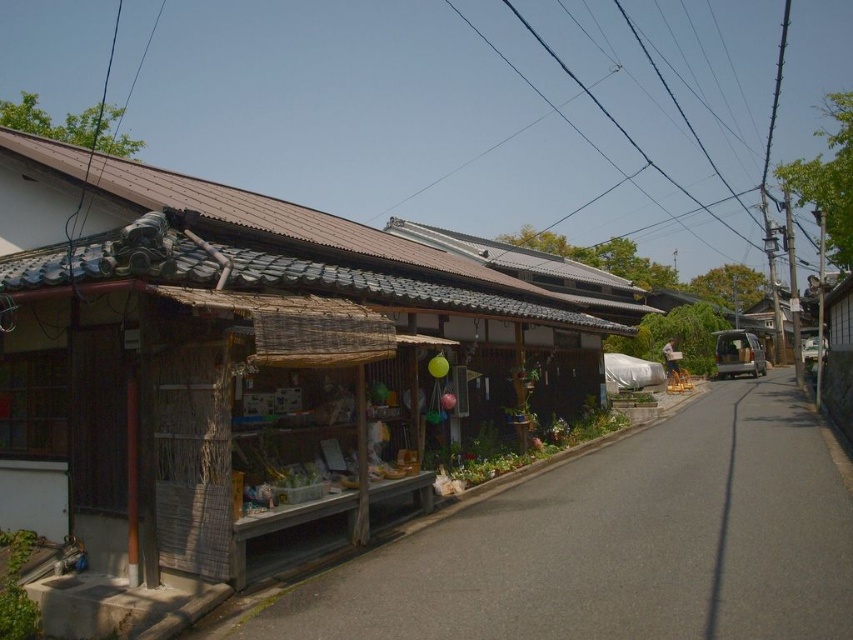
Who is more forward, (625, 580) or (737, 198)?

Point (625, 580) is more forward.

Can you confirm if wooden stall at lower left is positioned to the left of black wire at upper center?

Indeed, wooden stall at lower left is positioned on the left side of black wire at upper center.

Who is more forward, (x=717, y=502) or (x=689, y=196)?

Point (x=717, y=502) is more forward.

Where is `wooden stall at lower left`? This screenshot has width=853, height=640. wooden stall at lower left is located at coordinates click(x=618, y=545).

The image size is (853, 640). I want to click on wooden hut at center, so click(x=244, y=360).

Can you confirm if wooden hut at center is thinner than black wire at upper center?

Indeed, wooden hut at center has a lesser width compared to black wire at upper center.

Is point (343, 428) farther from viewer compared to point (503, 0)?

That is False.

You are a GUI agent. You are given a task and a screenshot of the screen. Output one action in this format:
    pyautogui.click(x=<x>, y=<y>)
    Task: Click on the wooden hut at center
    
    Given the screenshot: What is the action you would take?
    pyautogui.click(x=244, y=360)

Is point (20, 474) closer to viewer compared to point (415, 538)?

That is True.

Does wooden hut at center appear under wooden stall at lower left?

Incorrect, wooden hut at center is not positioned below wooden stall at lower left.

Who is more forward, (78, 451) or (776, 429)?

Point (78, 451) is in front.

This screenshot has width=853, height=640. What are the coordinates of `wooden hut at center` in the screenshot? It's located at (244, 360).